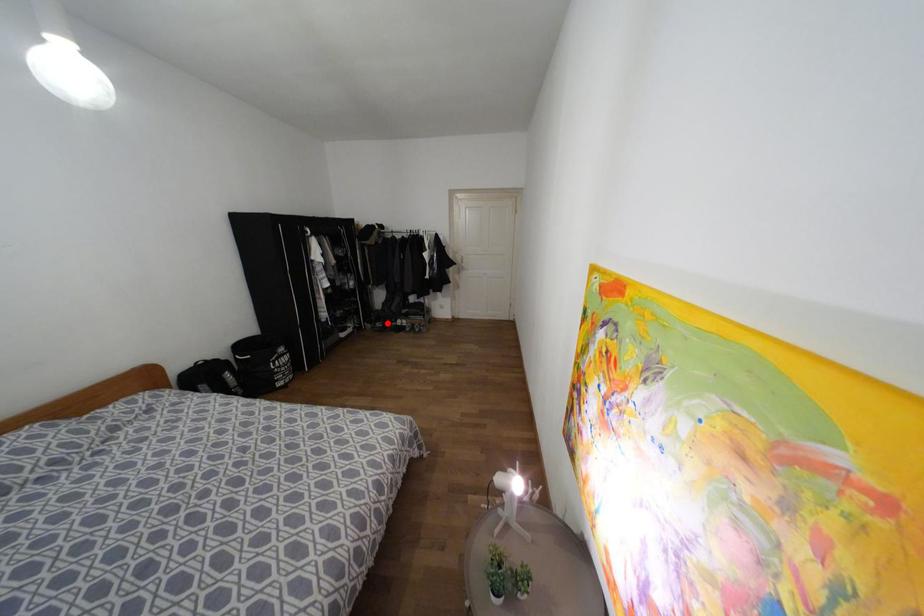
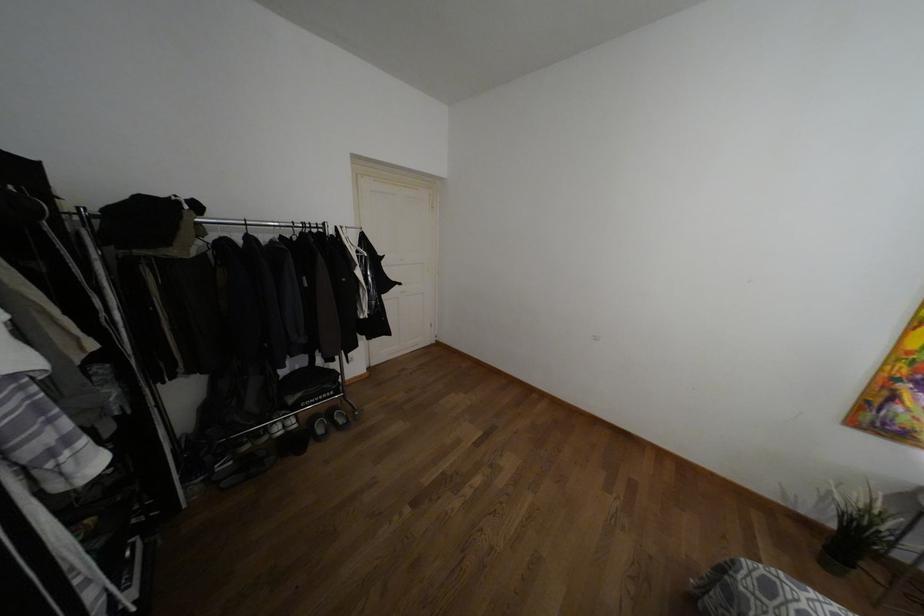
Question: I am providing you with two images of the same scene from different viewpoints. A red point is shown in image1. For the corresponding object point in image2, is it positioned nearer or farther from the camera?

Choices:
 (A) Nearer
 (B) Farther

Answer: (A)